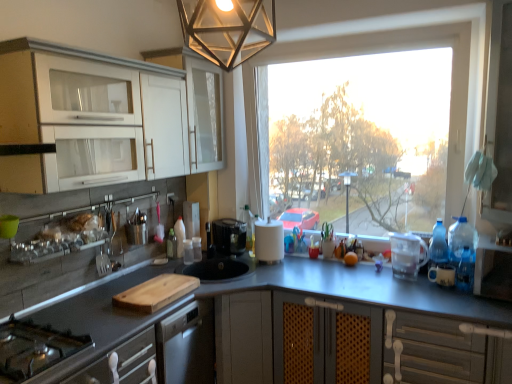
Locate an element on the screen. free space in front of blue plastic cup at right, the 2th appliance when ordered from right to left is located at coordinates (448, 301).